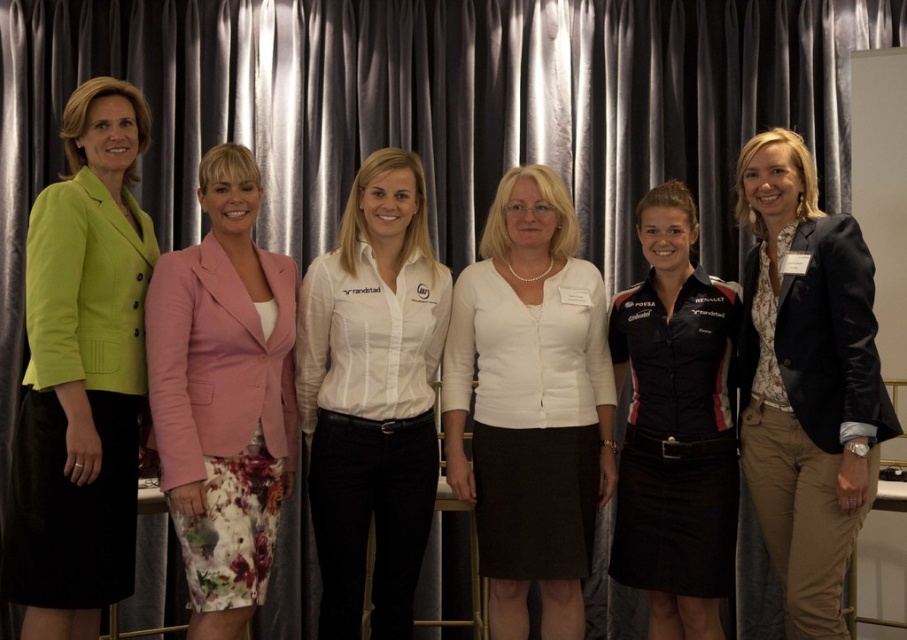
You are standing in front of the group of women. Where is the white shirt at center located in terms of its 2D coordinates?

The white shirt at center is located at the 2D coordinates of point (372, 396).

Based on the photo, you are a photographer setting up for a group photo. You need to ensure that the lime green fabric jacket at left and the black jersey at center are both visible in the frame. Given their sizes, which of these items requires more space horizontally to capture fully?

The black jersey at center requires more space horizontally because the lime green fabric jacket at left has a lesser width compared to black jersey at center.